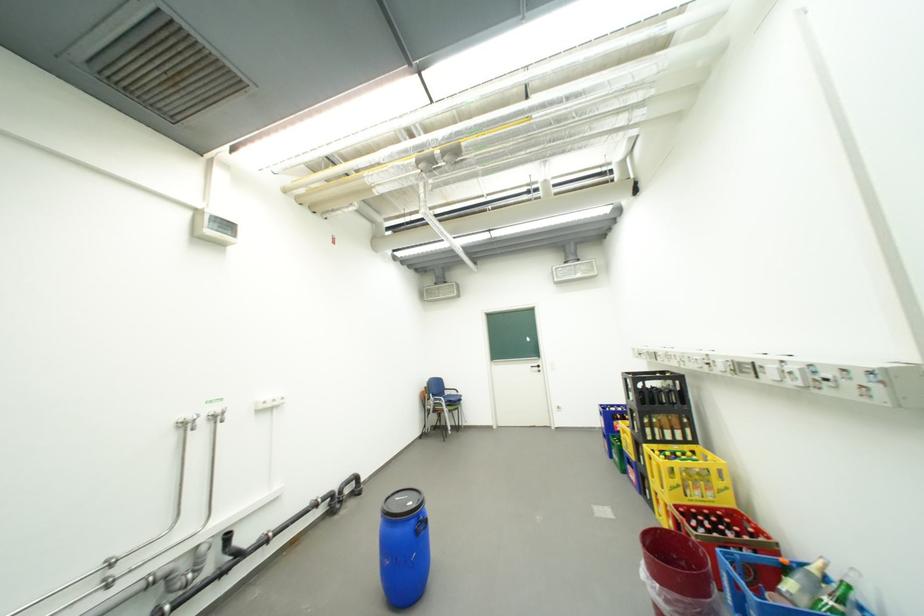
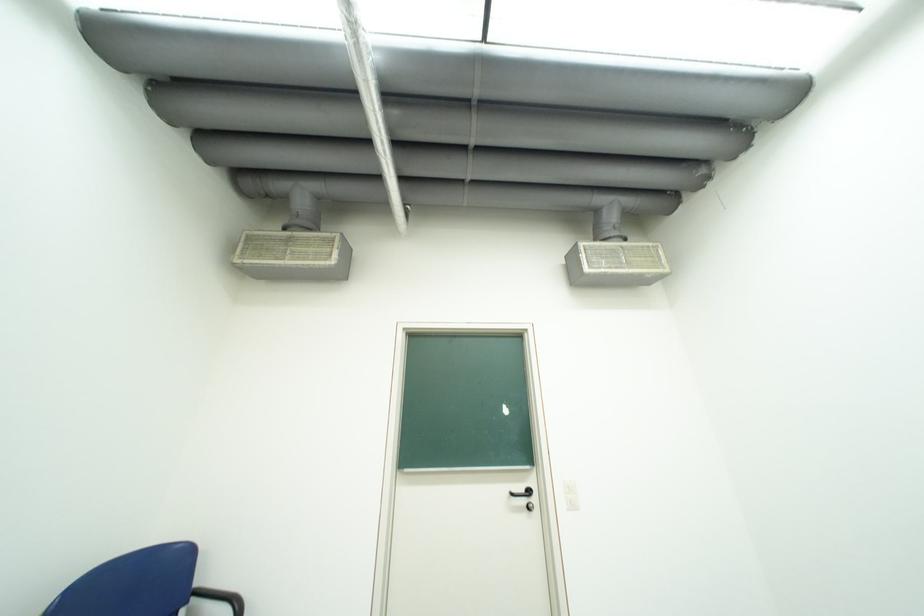
In the second image, find the point that corresponds to (x=541, y=368) in the first image.

(523, 495)